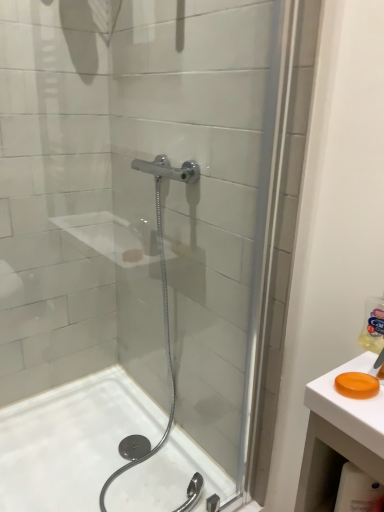
The image size is (384, 512). Describe the element at coordinates (71, 441) in the screenshot. I see `white glossy bath at lower left` at that location.

In order to face white glossy bath at lower left, should I rotate leftwards or rightwards?

You should look left and rotate roughly 12.773 degrees.

This screenshot has width=384, height=512. What are the coordinates of `white glossy bath at lower left` in the screenshot? It's located at (71, 441).

I want to click on white glossy bath at lower left, so point(71,441).